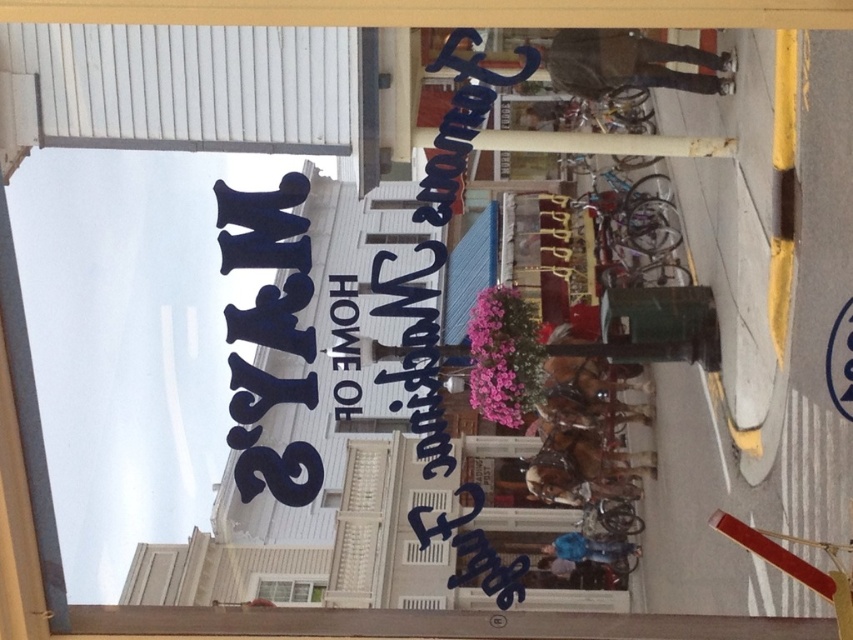
Question: Does white paper sign at upper center have a larger size compared to white matte window at lower center?

Choices:
 (A) no
 (B) yes

Answer: (B)

Question: Considering the real-world distances, which object is farthest from the blue painted sign at upper left?

Choices:
 (A) white paper sign at upper center
 (B) white matte window at lower center

Answer: (A)

Question: Estimate the real-world distances between objects in this image. Which object is farther from the blue painted sign at upper left?

Choices:
 (A) white matte window at lower center
 (B) white paper sign at upper center

Answer: (B)

Question: Can you confirm if blue painted sign at upper left is smaller than white paper sign at upper center?

Choices:
 (A) yes
 (B) no

Answer: (B)

Question: Which of the following is the farthest from the observer?

Choices:
 (A) (28, 326)
 (B) (378, 349)
 (C) (305, 588)

Answer: (C)

Question: Considering the relative positions of blue painted sign at upper left and white matte window at lower center in the image provided, where is blue painted sign at upper left located with respect to white matte window at lower center?

Choices:
 (A) left
 (B) right

Answer: (A)